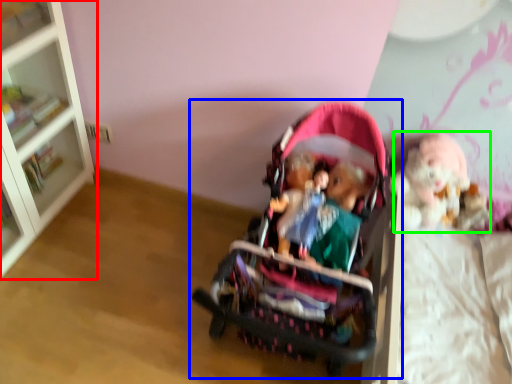
Question: Considering the real-world distances, which object is farthest from bookcase (highlighted by a red box)? toy (highlighted by a blue box) or doll (highlighted by a green box)?

Choices:
 (A) toy
 (B) doll

Answer: (B)